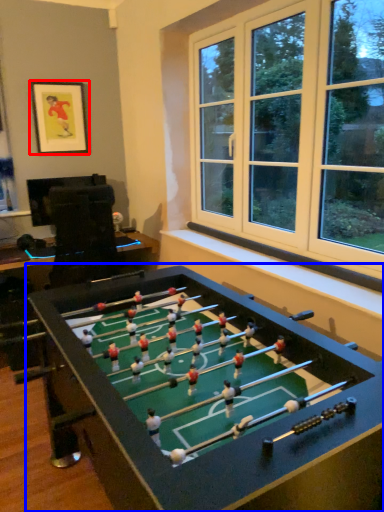
Question: Which of the following is the closest to the observer, picture frame (highlighted by a red box) or table (highlighted by a blue box)?

Choices:
 (A) picture frame
 (B) table

Answer: (B)